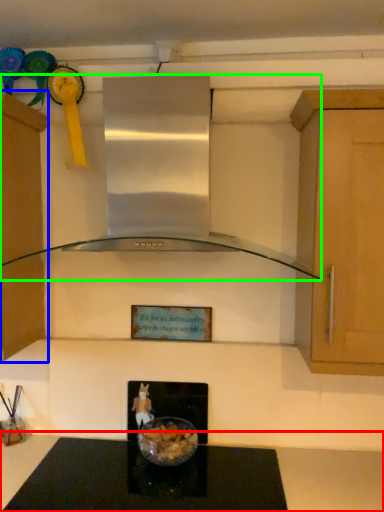
Question: Considering the real-world distances, which object is farthest from countertop (highlighted by a red box)? cabinetry (highlighted by a blue box) or home appliance (highlighted by a green box)?

Choices:
 (A) cabinetry
 (B) home appliance

Answer: (A)